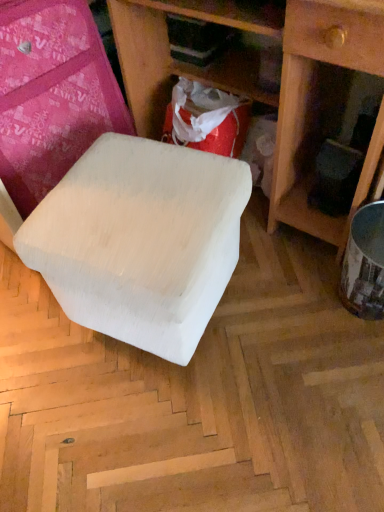
Image resolution: width=384 pixels, height=512 pixels. I want to click on free point above white matte stool at center (from a real-world perspective), so click(x=131, y=199).